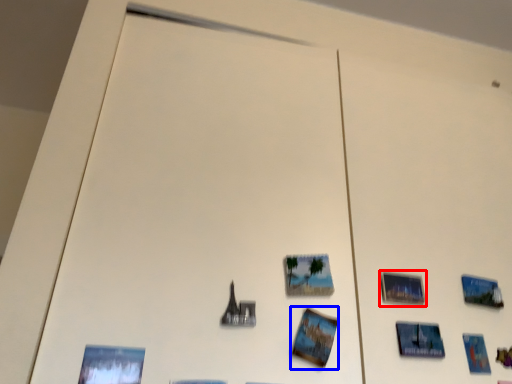
Question: Which of the following is the closest to the observer, picture frame (highlighted by a red box) or postcard (highlighted by a blue box)?

Choices:
 (A) picture frame
 (B) postcard

Answer: (B)